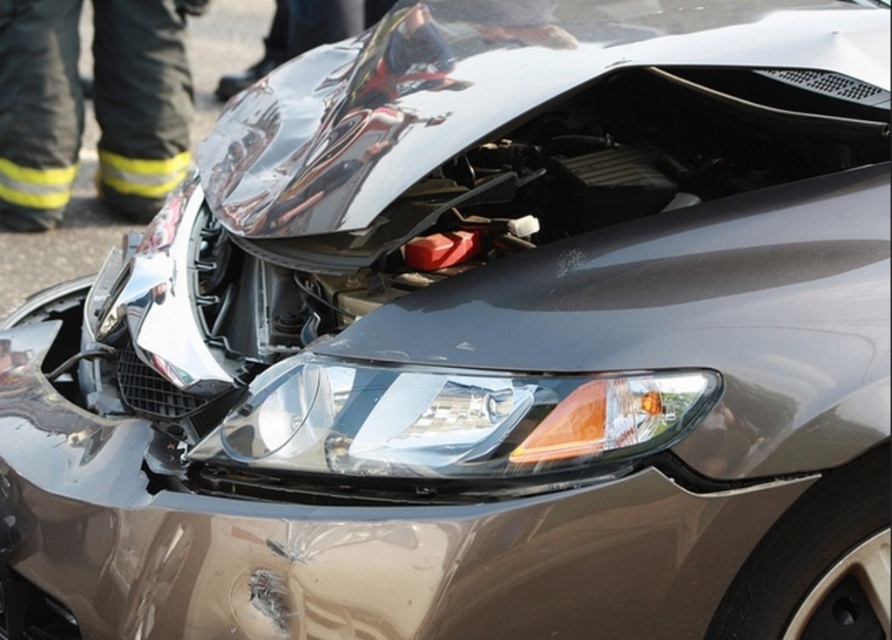
Based on the photo, you are a mechanic inspecting the damaged car. You notice the clear plastic headlight at center and the black fabric pants at left. Which object is positioned lower in relation to the other?

The clear plastic headlight at center is located below black fabric pants at left, so it is positioned lower.

You are an accident investigator examining the damaged car. You notice a clear plastic headlight at center and black fabric pants at left. Based on their positions, which object is located more to the right side of the car?

The clear plastic headlight at center is positioned on the right side of black fabric pants at left, so the clear plastic headlight at center is more to the right.

You are an accident investigator examining the damaged car. You notice the clear plastic headlight at center and the black fabric pants at left. Which object is positioned closer to your viewpoint?

The clear plastic headlight at center is closer to the viewer than the black fabric pants at left.